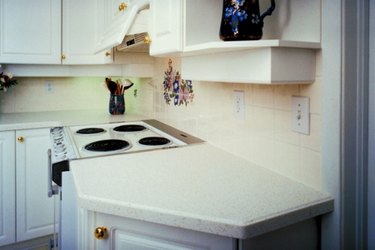
The height and width of the screenshot is (250, 375). Identify the location of bottom left burner. (90, 129).